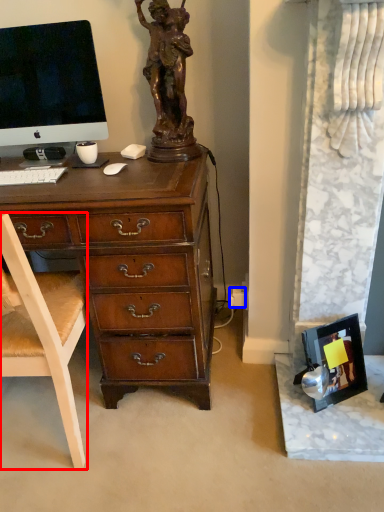
Question: Which point is closer to the camera, chair (highlighted by a red box) or power outlet (highlighted by a blue box)?

Choices:
 (A) chair
 (B) power outlet

Answer: (A)